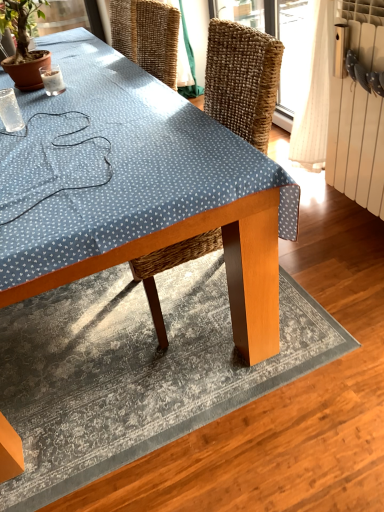
The image size is (384, 512). Find the location of `vacant area that is in front of wooden table at center`. vacant area that is in front of wooden table at center is located at coordinates (202, 383).